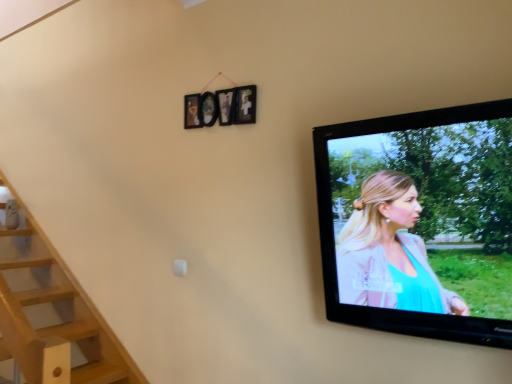
Question: Is wooden picture frame at upper center positioned far away from black glossy television at upper right?

Choices:
 (A) no
 (B) yes

Answer: (A)

Question: From the image's perspective, is wooden picture frame at upper center over black glossy television at upper right?

Choices:
 (A) yes
 (B) no

Answer: (A)

Question: Can you confirm if wooden picture frame at upper center is wider than black glossy television at upper right?

Choices:
 (A) no
 (B) yes

Answer: (A)

Question: Considering the relative sizes of wooden picture frame at upper center and black glossy television at upper right in the image provided, is wooden picture frame at upper center shorter than black glossy television at upper right?

Choices:
 (A) no
 (B) yes

Answer: (B)

Question: From the image's perspective, does wooden picture frame at upper center appear lower than black glossy television at upper right?

Choices:
 (A) no
 (B) yes

Answer: (A)

Question: Is wooden picture frame at upper center at the left side of black glossy television at upper right?

Choices:
 (A) no
 (B) yes

Answer: (B)

Question: Can you confirm if black glossy television at upper right is bigger than wooden picture frame at upper center?

Choices:
 (A) yes
 (B) no

Answer: (A)

Question: Considering the relative positions of black glossy television at upper right and wooden picture frame at upper center in the image provided, is black glossy television at upper right to the left of wooden picture frame at upper center from the viewer's perspective?

Choices:
 (A) no
 (B) yes

Answer: (A)

Question: Can you confirm if black glossy television at upper right is smaller than wooden picture frame at upper center?

Choices:
 (A) yes
 (B) no

Answer: (B)

Question: Does black glossy television at upper right have a greater width compared to wooden picture frame at upper center?

Choices:
 (A) no
 (B) yes

Answer: (B)

Question: Is black glossy television at upper right in contact with wooden picture frame at upper center?

Choices:
 (A) yes
 (B) no

Answer: (B)

Question: Does black glossy television at upper right lie in front of wooden picture frame at upper center?

Choices:
 (A) no
 (B) yes

Answer: (B)

Question: In terms of size, does black glossy television at upper right appear bigger or smaller than wooden picture frame at upper center?

Choices:
 (A) big
 (B) small

Answer: (A)